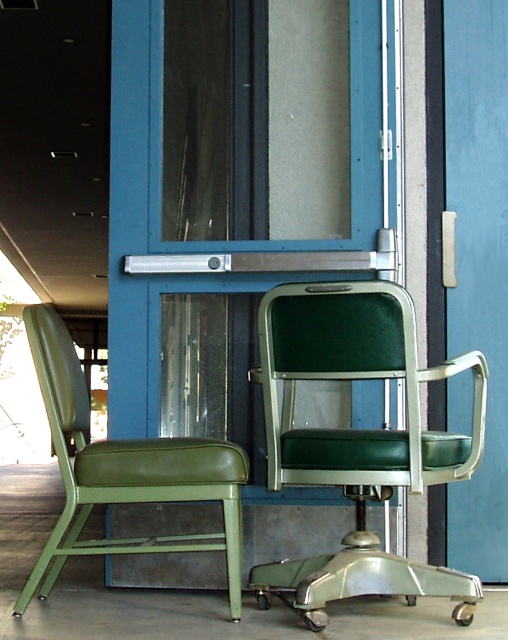
You are standing in front of the blue door and want to move from the green leather chair at left to the green leather swivel chair at center. Which direction should you move?

You should move to the right because the green leather swivel chair at center is to the right of the green leather chair at left.

You are a delivery person trying to move a large package through the space between the green leather swivel chair at center and the green leather chair at left. The package is 16 inches wide. Can the package fit through the gap between them?

The green leather swivel chair at center and green leather chair at left are 16.96 inches apart from each other. Since the package is 16 inches wide, it can fit through the gap between them as there is enough space.

You are standing at the origin point of the room, which is at coordinates 0,0. You want to move to the green leather swivel chair at center. What are the coordinates you need to move to?

The coordinates you need to move to are (358, 440) to reach the green leather swivel chair at center.